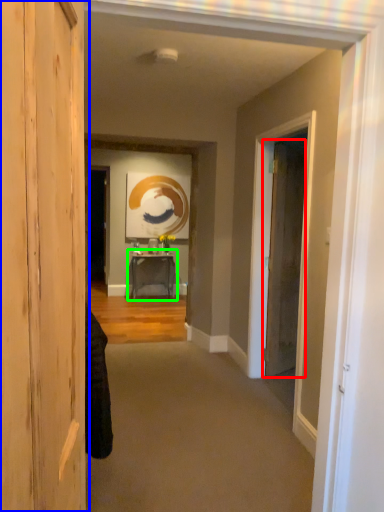
Question: Which is farther away from door (highlighted by a red box)? door (highlighted by a blue box) or table (highlighted by a green box)?

Choices:
 (A) door
 (B) table

Answer: (A)